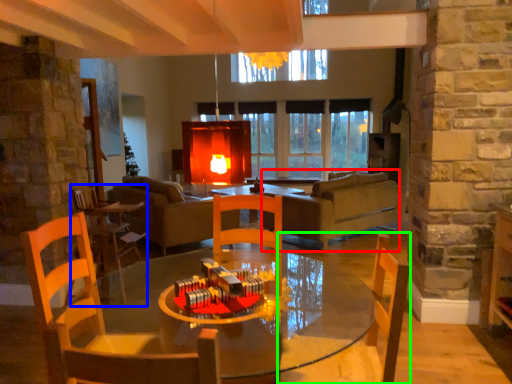
Question: Based on their relative distances, which object is nearer to couch (highlighted by a red box)? Choose from chair (highlighted by a blue box) and chair (highlighted by a green box).

Choices:
 (A) chair
 (B) chair

Answer: (A)